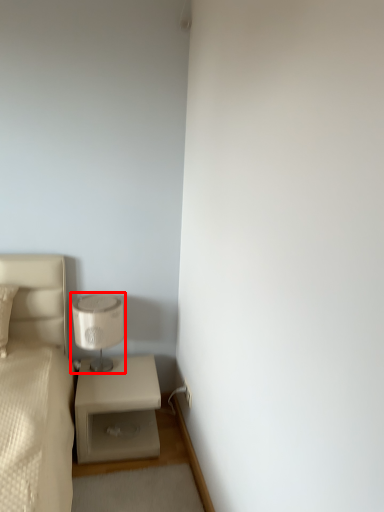
Question: From the image, what is the correct spatial relationship of table lamp (annotated by the red box) in relation to nightstand?

Choices:
 (A) left
 (B) right

Answer: (A)